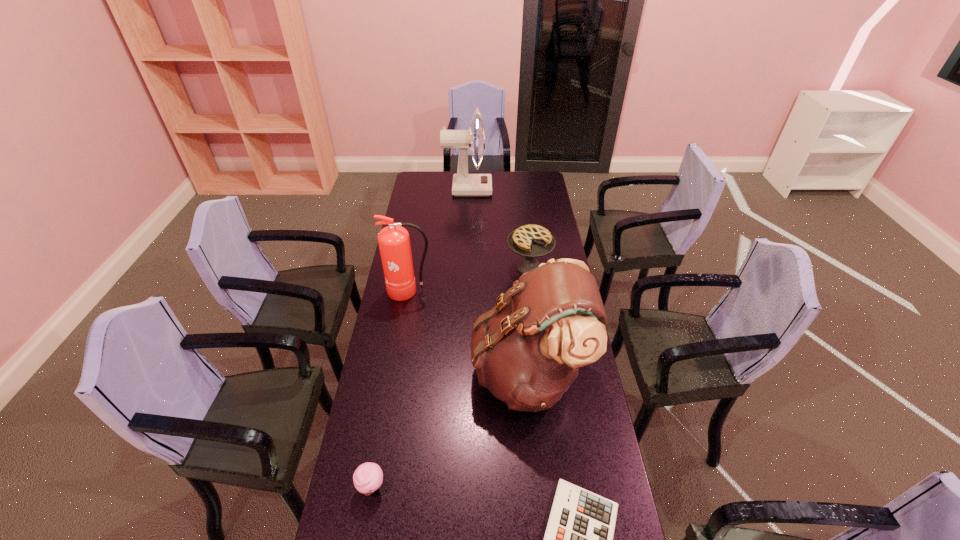
At what (x,y) coordinates should I click in order to perform the action: click on the farthest object. Please return your answer as a coordinate pair (x, y). Image resolution: width=960 pixels, height=540 pixels. Looking at the image, I should click on (464, 184).

In order to click on satchel in this screenshot , I will do `click(527, 350)`.

The height and width of the screenshot is (540, 960). Find the location of `fire extinguisher`. fire extinguisher is located at coordinates (394, 243).

Where is `pie`? Image resolution: width=960 pixels, height=540 pixels. pie is located at coordinates (531, 241).

This screenshot has height=540, width=960. I want to click on the fifth tallest object, so click(x=368, y=477).

The width and height of the screenshot is (960, 540). What are the coordinates of `vacant space located on the front-facing side of the fan` in the screenshot? It's located at (506, 189).

Identify the location of free space located at the front of the fourth farthest object with buckles. (407, 373).

The width and height of the screenshot is (960, 540). In order to click on blank space located at the front of the fourth farthest object with buckles in this screenshot , I will do `click(391, 373)`.

Where is `free space located at the front of the fourth farthest object with buckles`? The image size is (960, 540). free space located at the front of the fourth farthest object with buckles is located at coordinates (376, 373).

The height and width of the screenshot is (540, 960). In order to click on free space located towards the nozzle of the fourth shortest object in this screenshot , I will do `click(404, 328)`.